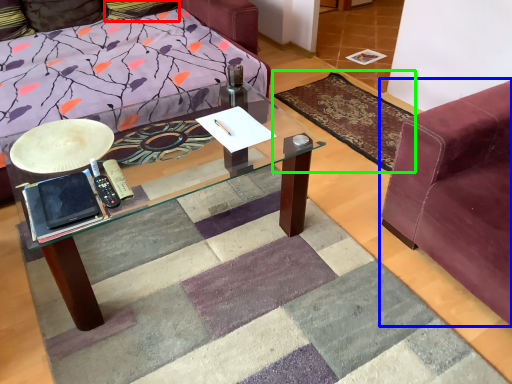
Question: Which object is positioned closest to pillow (highlighted by a red box)? Select from studio couch (highlighted by a blue box) and mat (highlighted by a green box).

Choices:
 (A) studio couch
 (B) mat

Answer: (B)